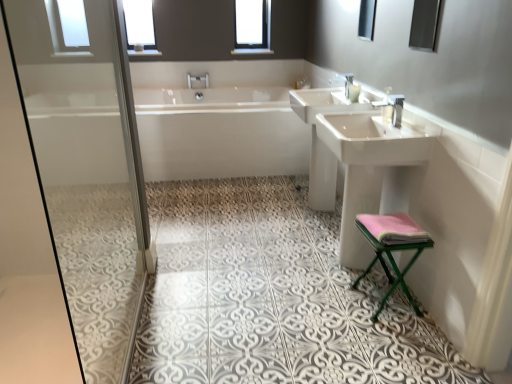
Question: Does white glossy bathtub at center have a lesser height compared to pink fabric towel at lower right?

Choices:
 (A) yes
 (B) no

Answer: (B)

Question: Considering the relative positions of white glossy bathtub at center and pink fabric towel at lower right in the image provided, is white glossy bathtub at center to the right of pink fabric towel at lower right from the viewer's perspective?

Choices:
 (A) no
 (B) yes

Answer: (A)

Question: Is white glossy bathtub at center smaller than pink fabric towel at lower right?

Choices:
 (A) yes
 (B) no

Answer: (B)

Question: From a real-world perspective, is white glossy bathtub at center beneath pink fabric towel at lower right?

Choices:
 (A) yes
 (B) no

Answer: (A)

Question: Is white glossy bathtub at center further to camera compared to pink fabric towel at lower right?

Choices:
 (A) no
 (B) yes

Answer: (B)

Question: From a real-world perspective, is matte glass mirror at upper right, which is counted as the second mirror, starting from the back, positioned above or below silver metallic tap at upper center, which ranks as the 2th tap in left-to-right order?

Choices:
 (A) above
 (B) below

Answer: (A)

Question: Do you think matte glass mirror at upper right, which is counted as the first mirror, starting from the front, is within silver metallic tap at upper center, the first tap in the front-to-back sequence, or outside of it?

Choices:
 (A) inside
 (B) outside

Answer: (B)

Question: Is matte glass mirror at upper right, positioned as the 2th mirror in left-to-right order, wider or thinner than silver metallic tap at upper center, positioned as the 2th tap in top-to-bottom order?

Choices:
 (A) wide
 (B) thin

Answer: (B)

Question: From the image's perspective, is matte glass mirror at upper right, which is the 1th mirror from bottom to top, located above or below silver metallic tap at upper center, the first tap in the front-to-back sequence?

Choices:
 (A) below
 (B) above

Answer: (B)

Question: Relative to white glossy sink at center, arranged as the first sink when viewed from the back, is matte glass mirror at upper right, positioned as the 2th mirror in left-to-right order, in front or behind?

Choices:
 (A) front
 (B) behind

Answer: (A)

Question: Is matte glass mirror at upper right, which is counted as the first mirror, starting from the front, taller or shorter than white glossy sink at center, arranged as the first sink when viewed from the back?

Choices:
 (A) tall
 (B) short

Answer: (B)

Question: Is matte glass mirror at upper right, positioned as the 2th mirror in left-to-right order, wider or thinner than white glossy sink at center, arranged as the first sink when viewed from the back?

Choices:
 (A) wide
 (B) thin

Answer: (B)

Question: From a real-world perspective, is matte glass mirror at upper right, which is counted as the first mirror, starting from the right, above or below white glossy sink at center, arranged as the first sink when viewed from the back?

Choices:
 (A) below
 (B) above

Answer: (B)

Question: From a real-world perspective, is white glossy sink at right, acting as the first sink starting from the front, positioned above or below clear glass window at upper center, the 1th window from the right?

Choices:
 (A) below
 (B) above

Answer: (A)

Question: Which is correct: white glossy sink at right, acting as the first sink starting from the front, is inside clear glass window at upper center, marked as the 2th window in a left-to-right arrangement, or outside of it?

Choices:
 (A) outside
 (B) inside

Answer: (A)